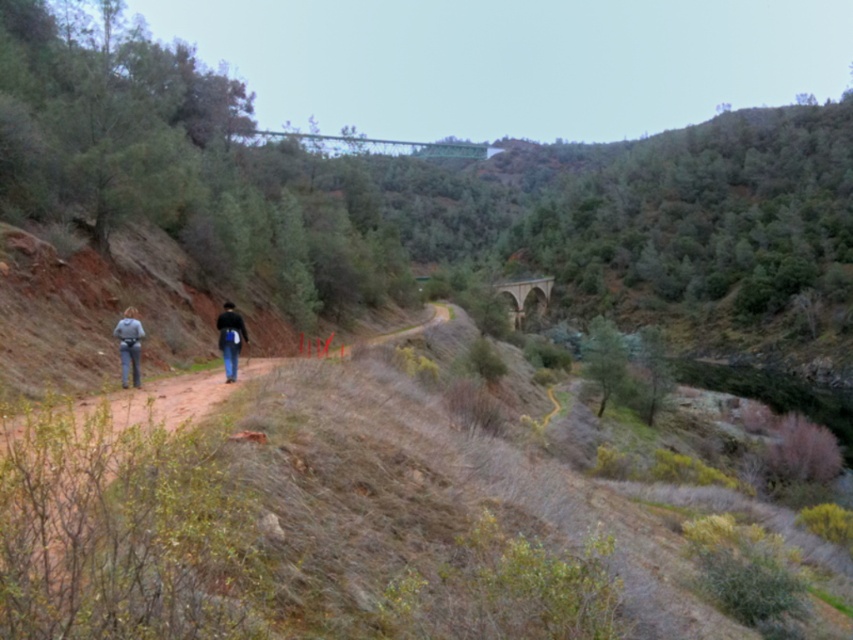
Is point (126, 353) farther from camera compared to point (132, 358)?

No, it is in front of (132, 358).

Which of these two, dark gray jeans at left or denim pants at left, stands shorter?

dark gray jeans at left is shorter.

At what (x,y) coordinates should I click in order to perform the action: click on dark gray jeans at left. Please return your answer as a coordinate pair (x, y). The width and height of the screenshot is (853, 640). Looking at the image, I should click on (230, 339).

The height and width of the screenshot is (640, 853). I want to click on dark gray jeans at left, so click(230, 339).

Does dark gray jeans at left have a larger size compared to dark blue jacket at center?

No, dark gray jeans at left is not bigger than dark blue jacket at center.

Does dark gray jeans at left appear on the right side of dark blue jacket at center?

In fact, dark gray jeans at left is to the left of dark blue jacket at center.

This screenshot has width=853, height=640. I want to click on dark gray jeans at left, so click(x=230, y=339).

Between denim pants at left and dark blue jacket at center, which one is positioned higher?

denim pants at left is above.

Measure the distance between denim pants at left and dark blue jacket at center.

They are 7.52 feet apart.

Between point (126, 337) and point (228, 323), which one is positioned behind?

Positioned behind is point (228, 323).

Identify the location of denim pants at left. Image resolution: width=853 pixels, height=640 pixels. 129,346.